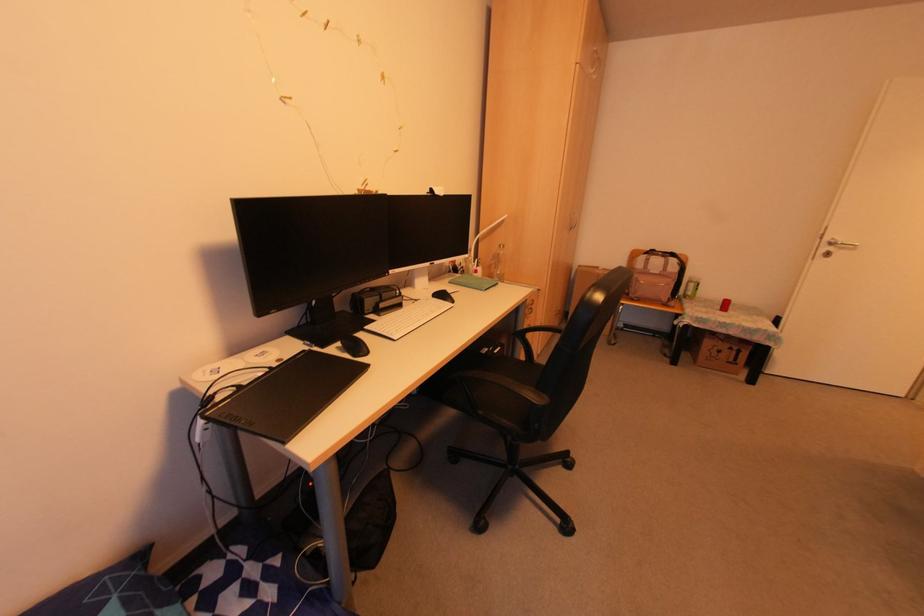
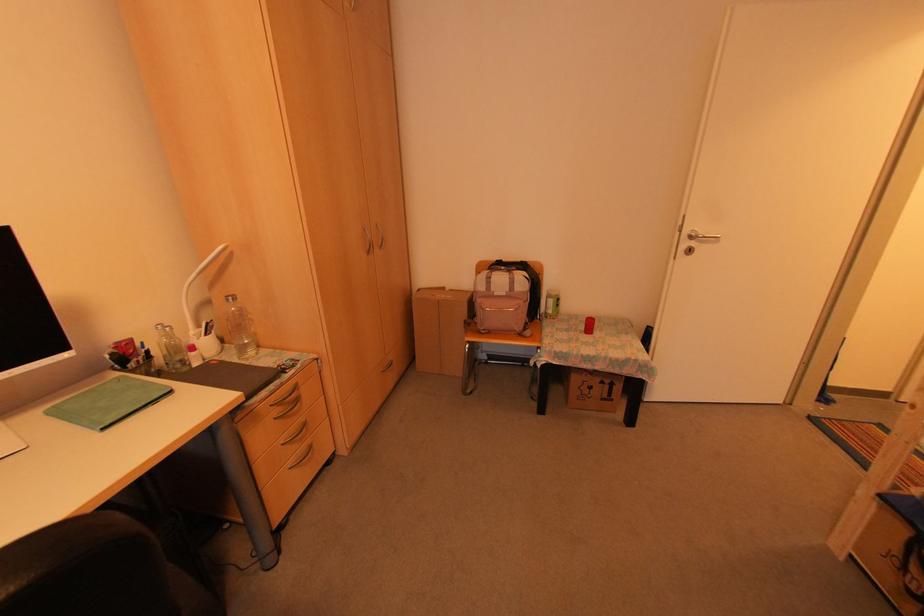
In the second image, find the point that corresponds to (556,310) in the first image.

(388, 359)